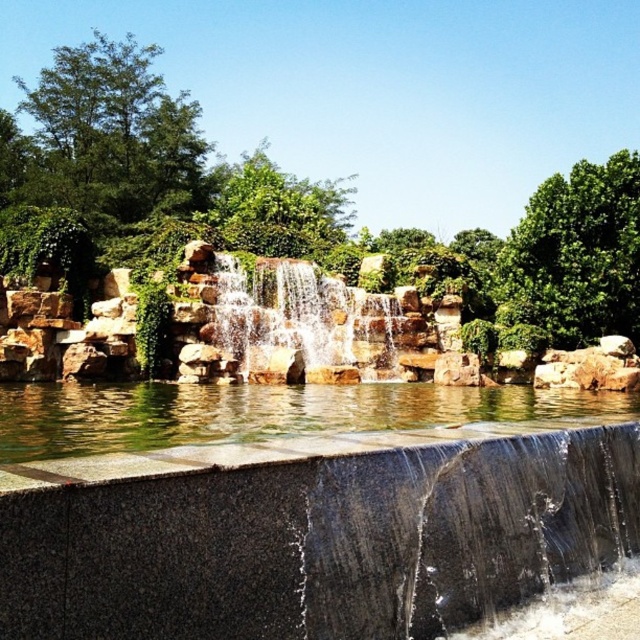
Is clear water at center below smooth stone waterfall at center?

Yes.

Between point (54, 403) and point (252, 285), which one is positioned in front?

Point (54, 403) is in front.

Describe the element at coordinates (260, 412) in the screenshot. This screenshot has height=640, width=640. I see `clear water at center` at that location.

At what (x,y) coordinates should I click in order to perform the action: click on clear water at center. Please return your answer as a coordinate pair (x, y). This screenshot has width=640, height=640. Looking at the image, I should click on (260, 412).